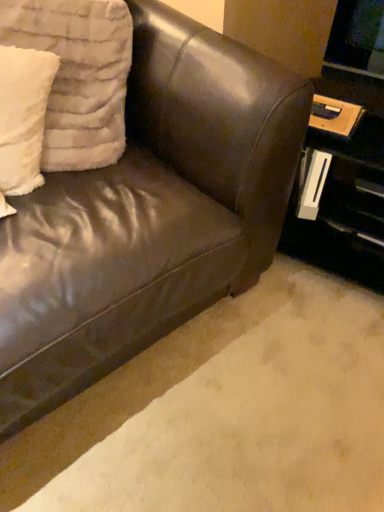
Question: Is white fluffy pillow at upper left, acting as the second pillow starting from the left, located outside brown leather couch at upper left?

Choices:
 (A) yes
 (B) no

Answer: (B)

Question: Can you confirm if white fluffy pillow at upper left, which is the first pillow in right-to-left order, is thinner than brown leather couch at upper left?

Choices:
 (A) yes
 (B) no

Answer: (A)

Question: Is white fluffy pillow at upper left, acting as the second pillow starting from the left, smaller than brown leather couch at upper left?

Choices:
 (A) no
 (B) yes

Answer: (B)

Question: Is white fluffy pillow at upper left, which is the first pillow in right-to-left order, bigger than brown leather couch at upper left?

Choices:
 (A) yes
 (B) no

Answer: (B)

Question: Is white fluffy pillow at upper left, acting as the second pillow starting from the left, further to camera compared to brown leather couch at upper left?

Choices:
 (A) yes
 (B) no

Answer: (A)

Question: Could you tell me if white fluffy pillow at upper left, acting as the second pillow starting from the left, is facing brown leather couch at upper left?

Choices:
 (A) yes
 (B) no

Answer: (A)

Question: Is white fluffy pillow at upper left, acting as the second pillow starting from the left, outside of white fluffy pillow at upper left, the first pillow from the left?

Choices:
 (A) yes
 (B) no

Answer: (A)

Question: Does white fluffy pillow at upper left, which is the first pillow in right-to-left order, have a lesser height compared to white fluffy pillow at upper left, the 2th pillow viewed from the right?

Choices:
 (A) no
 (B) yes

Answer: (A)

Question: From a real-world perspective, is white fluffy pillow at upper left, which is the first pillow in right-to-left order, on top of white fluffy pillow at upper left, the 2th pillow viewed from the right?

Choices:
 (A) no
 (B) yes

Answer: (B)

Question: Can white fluffy pillow at upper left, the 2th pillow viewed from the right, be found inside white fluffy pillow at upper left, acting as the second pillow starting from the left?

Choices:
 (A) no
 (B) yes

Answer: (B)

Question: Could you tell me if white fluffy pillow at upper left, which is the first pillow in right-to-left order, is turned towards white fluffy pillow at upper left, the 2th pillow viewed from the right?

Choices:
 (A) yes
 (B) no

Answer: (A)

Question: Are white fluffy pillow at upper left, acting as the second pillow starting from the left, and white fluffy pillow at upper left, the 2th pillow viewed from the right, located far from each other?

Choices:
 (A) no
 (B) yes

Answer: (A)

Question: From the image's perspective, is white fluffy pillow at upper left, the 2th pillow viewed from the right, over brown leather couch at lower left?

Choices:
 (A) yes
 (B) no

Answer: (A)